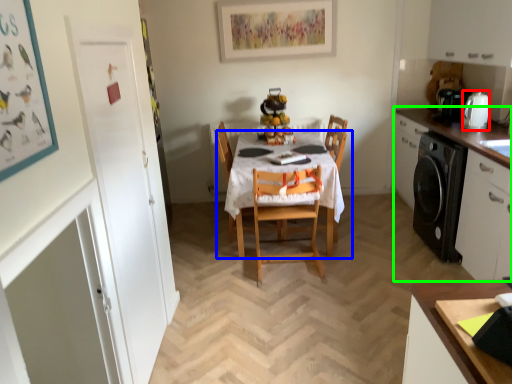
Question: Which is farther away from appliance (highlighted by a red box)? kitchen & dining room table (highlighted by a blue box) or cabinetry (highlighted by a green box)?

Choices:
 (A) kitchen & dining room table
 (B) cabinetry

Answer: (A)